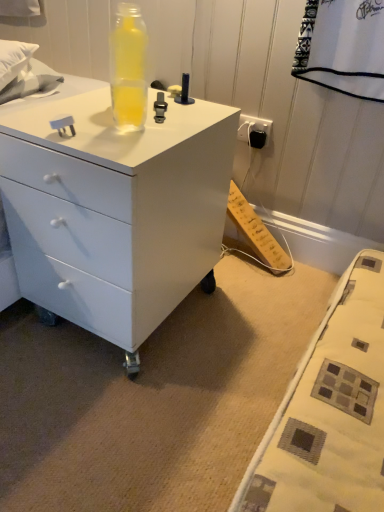
Where is `free space behind transparent plastic bottle at upper center`? This screenshot has width=384, height=512. free space behind transparent plastic bottle at upper center is located at coordinates 159,109.